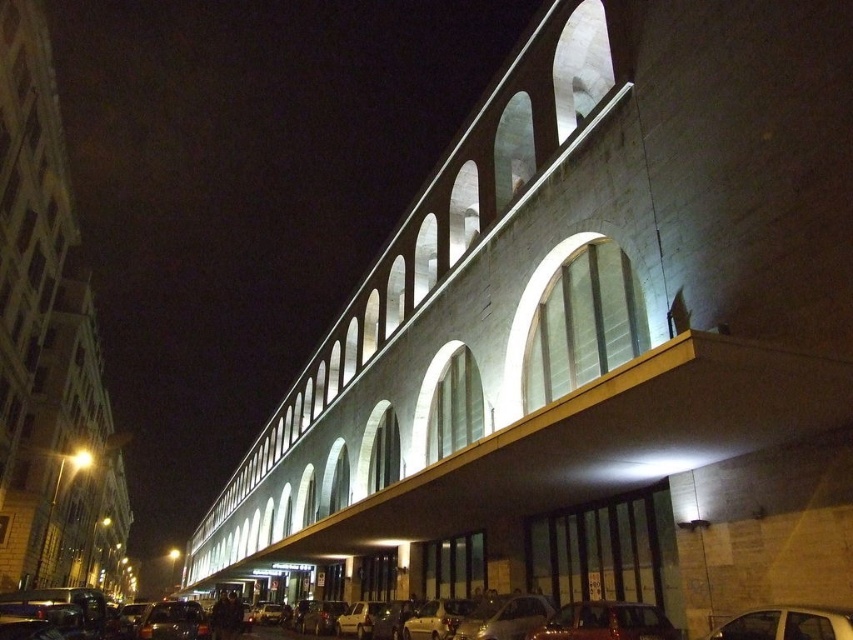
You are standing at a viewpoint 100 meters away from the building. You want to know if the point at coordinates point (561, 611) on the building is closer to you than the camera position. Can you determine this?

The distance of point (561, 611) from camera is 37.78 meters. Since the camera is positioned at 100 meters away from the building, the point is closer to you than the camera position.

You are standing in front of the modern architectural structure at night. You see two points marked on the building facade. The first point is at coordinate point (635,616) and the second is at point (155,632). Which point is nearer to your current position?

Point (635,616) is closer to the camera than point (155,632), so the first point is nearer to your current position.